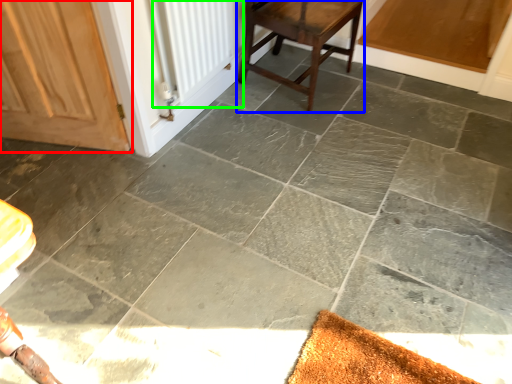
Question: Considering the real-world distances, which object is closest to door (highlighted by a red box)? stool (highlighted by a blue box) or radiator (highlighted by a green box).

Choices:
 (A) stool
 (B) radiator

Answer: (B)